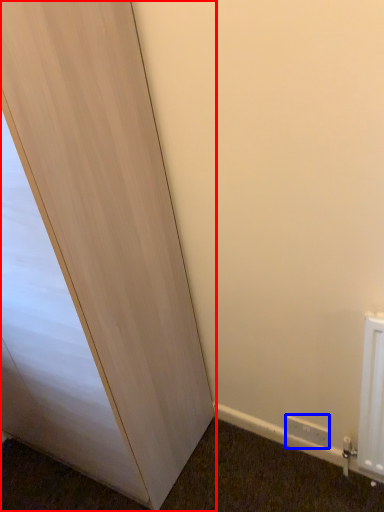
Question: Among these objects, which one is nearest to the camera, door (highlighted by a red box) or electric outlet (highlighted by a blue box)?

Choices:
 (A) door
 (B) electric outlet

Answer: (A)